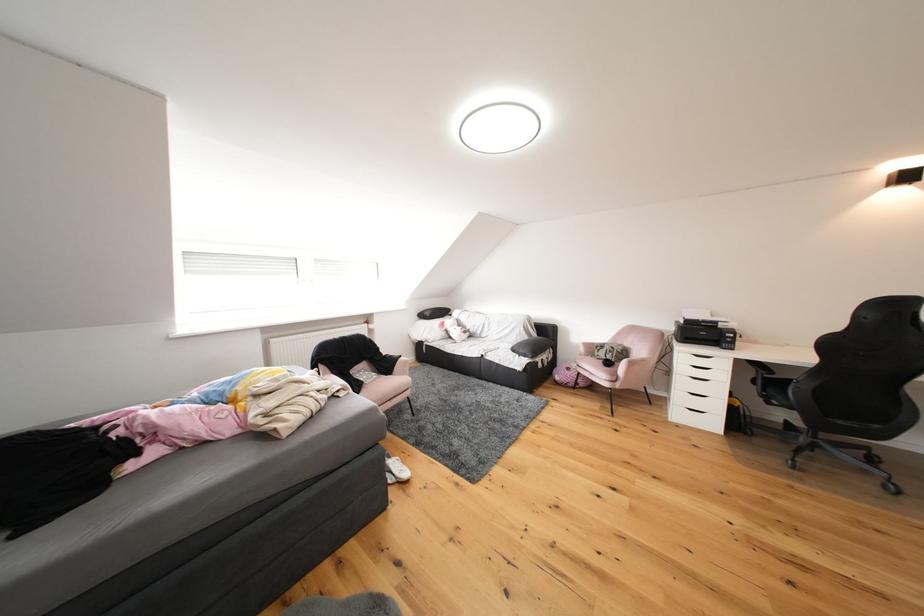
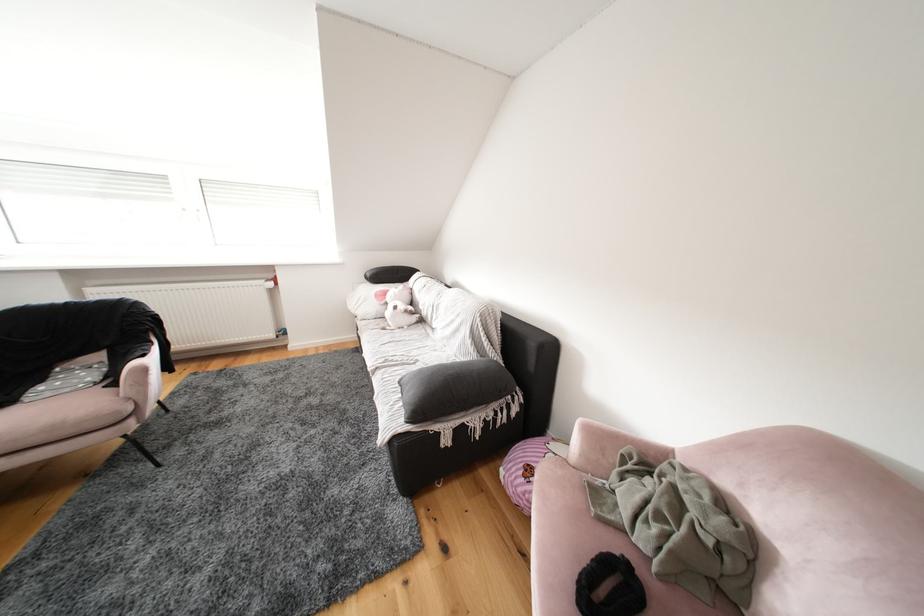
The images are taken continuously from a first-person perspective. In which direction are you moving?

The movement direction of the cameraman is right, forward.